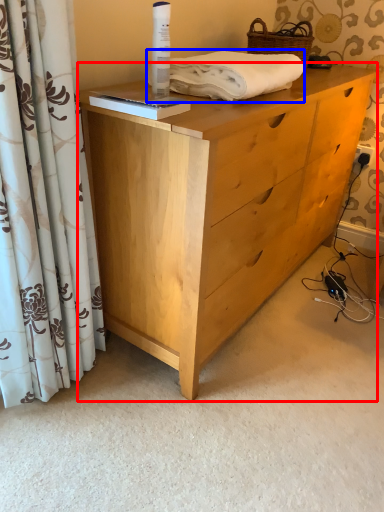
Question: Among these objects, which one is nearest to the camera, chest of drawers (highlighted by a red box) or bath towel (highlighted by a blue box)?

Choices:
 (A) chest of drawers
 (B) bath towel

Answer: (A)